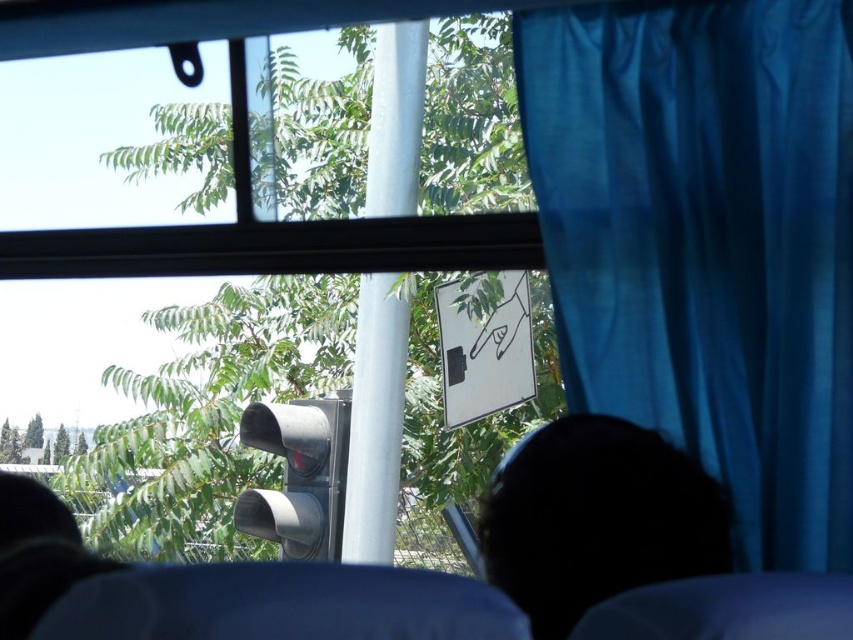
You are a passenger sitting in the bus and you see the blue fabric curtain at right and the black matte head at lower center. Which object is closer to the ceiling of the bus?

The blue fabric curtain at right is above the black matte head at lower center, so it is closer to the ceiling of the bus.

You are a passenger sitting in the bus and looking out the window. You notice the blue fabric curtain at right and the metallic gray traffic light at center. Which object is taller when viewed from your seat?

The blue fabric curtain at right is taller than the metallic gray traffic light at center.